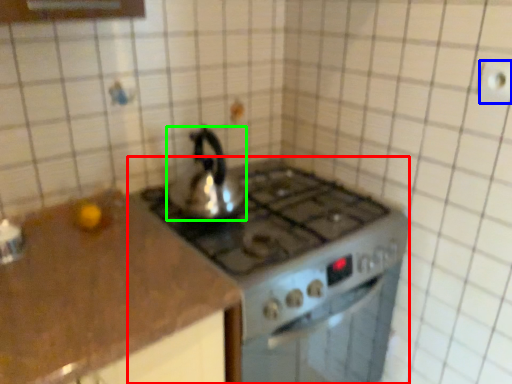
Question: Considering the real-world distances, which object is closest to gas stove (highlighted by a red box)? electric outlet (highlighted by a blue box) or kettle (highlighted by a green box).

Choices:
 (A) electric outlet
 (B) kettle

Answer: (B)